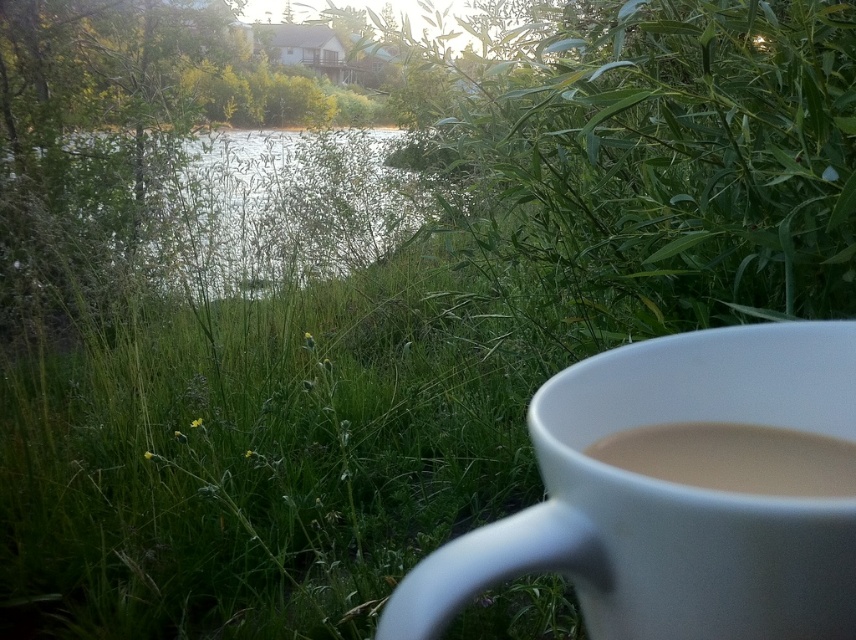
Question: In this image, where is white ceramic mug at lower right located relative to white matte cup at lower right?

Choices:
 (A) below
 (B) above

Answer: (A)

Question: Which point is closer to the camera taking this photo?

Choices:
 (A) (825, 496)
 (B) (626, 538)
 (C) (378, 136)

Answer: (B)

Question: Is white ceramic mug at lower right positioned in front of green grassy river at center?

Choices:
 (A) no
 (B) yes

Answer: (B)

Question: Estimate the real-world distances between objects in this image. Which object is closer to the green grassy river at center?

Choices:
 (A) white matte cup at lower right
 (B) white ceramic mug at lower right

Answer: (B)

Question: Is green grassy river at center positioned behind white matte cup at lower right?

Choices:
 (A) no
 (B) yes

Answer: (B)

Question: Estimate the real-world distances between objects in this image. Which object is closer to the green grassy river at center?

Choices:
 (A) white matte cup at lower right
 (B) white ceramic mug at lower right

Answer: (B)